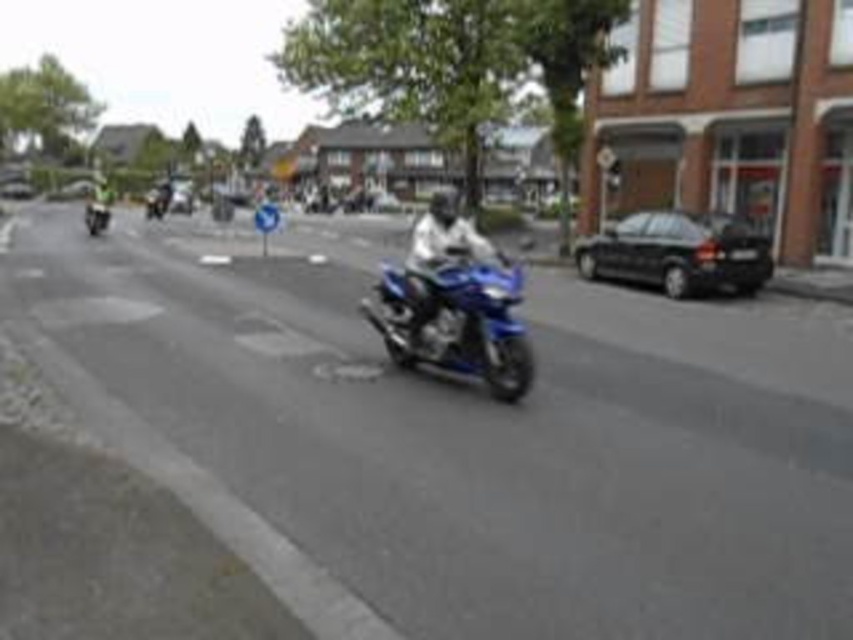
You are a delivery driver who needs to park your black glossy car at right in a parking spot that is 1000 feet away from the camera. Can your car fit in the parking spot based on the distance provided?

The black glossy car at right is 883.47 feet from the camera, which is within the 1000 feet distance of the parking spot. Therefore, the car can fit in the parking spot.

You are a delivery driver who needs to park your vehicle in this street scene. The parking spot is located at the coordinates point (456, 321). Can you safely park your vehicle there without blocking the motorcycle?

The point (456, 321) corresponds to the shiny blue motorcycle at center, so parking there would block the motorcycle. Choose another spot.

Consider the image. You are a photographer trying to capture both the white leather jacket at center and the shiny blue motorcycle at left in a single frame. Given their sizes, which object would require you to adjust your camera angle to include more of it in the shot?

The white leather jacket at center requires adjusting the camera angle to include more of it in the shot because its width is larger than the shiny blue motorcycle at left.